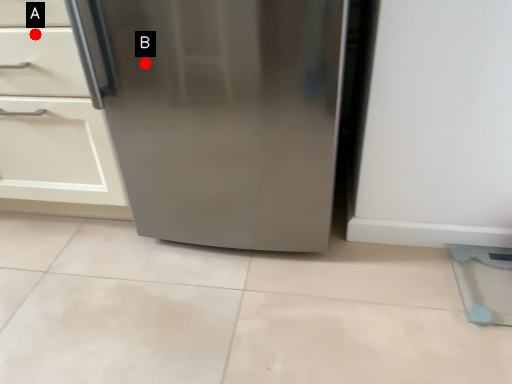
Question: Two points are circled on the image, labeled by A and B beside each circle. Which point appears farthest from the camera in this image?

Choices:
 (A) A is further
 (B) B is further

Answer: (A)